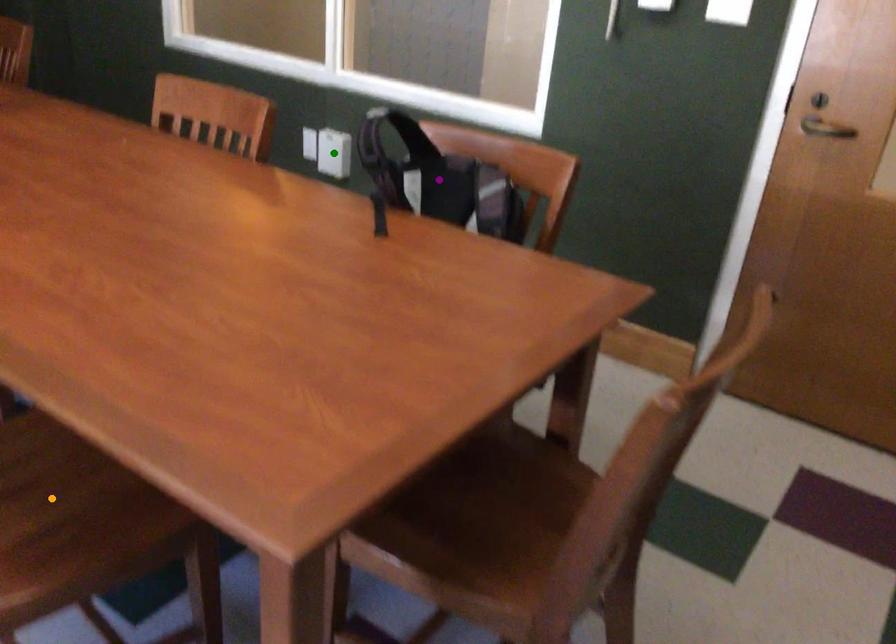
Order these from nearest to farthest:
orange point, green point, purple point

orange point → purple point → green point